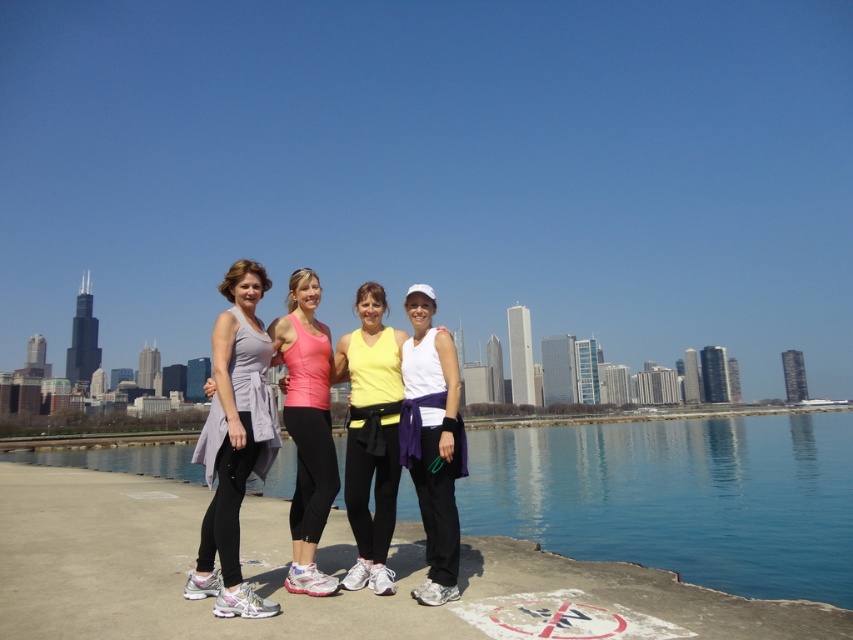
Question: Which object is the closest to the matte yellow tank top at center?

Choices:
 (A) white matte tank top at center
 (B) blue water at lower center
 (C) matte gray tank top at left

Answer: (A)

Question: Does matte yellow tank top at center have a greater width compared to white matte tank top at center?

Choices:
 (A) yes
 (B) no

Answer: (A)

Question: Is the position of matte gray tank top at left less distant than that of matte yellow tank top at center?

Choices:
 (A) yes
 (B) no

Answer: (A)

Question: Is blue water at lower center smaller than matte gray tank top at left?

Choices:
 (A) yes
 (B) no

Answer: (B)

Question: Considering the real-world distances, which object is closest to the matte gray tank top at left?

Choices:
 (A) matte yellow tank top at center
 (B) blue water at lower center
 (C) white matte tank top at center

Answer: (A)

Question: Which point appears closest to the camera in this image?

Choices:
 (A) (712, 531)
 (B) (451, 448)
 (C) (338, 340)
 (D) (212, 576)

Answer: (D)